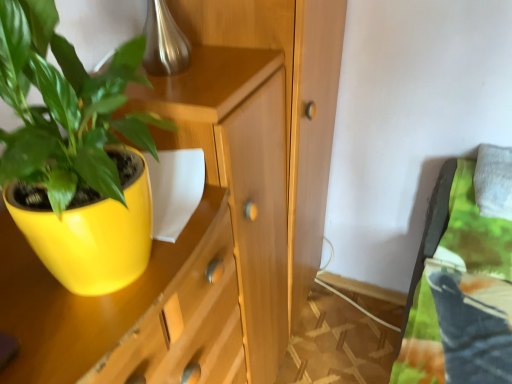
What do you see at coordinates (207, 213) in the screenshot?
I see `matte wood cabinet at center` at bounding box center [207, 213].

Image resolution: width=512 pixels, height=384 pixels. What are the coordinates of `matte wood cabinet at center` in the screenshot? It's located at (207, 213).

The height and width of the screenshot is (384, 512). What are the coordinates of `wooden dresser at center` in the screenshot? It's located at (288, 103).

Measure the distance between matte yellow pot at left and camera.

The depth of matte yellow pot at left is 15.63 inches.

The width and height of the screenshot is (512, 384). What are the coordinates of `matte wood cabinet at center` in the screenshot? It's located at (207, 213).

Identify the location of dresser on the right side of matte yellow pot at left. Image resolution: width=512 pixels, height=384 pixels. (288, 103).

From the picture: Is matte yellow pot at left next to wooden dresser at center and touching it?

→ No, matte yellow pot at left is not next to wooden dresser at center.

Is point (8, 156) in front of point (317, 56)?

Yes, point (8, 156) is closer to viewer.

Which is correct: matte yellow pot at left is inside wooden dresser at center, or outside of it?

matte yellow pot at left cannot be found inside wooden dresser at center.

Which of these two, white fabric pillow at upper right or wooden dresser at center, stands taller?

wooden dresser at center is taller.

From a real-world perspective, is white fabric pillow at upper right on wooden dresser at center?

Indeed, from a real-world perspective, white fabric pillow at upper right stands above wooden dresser at center.

From the image's perspective, is white fabric pillow at upper right on wooden dresser at center?

Yes, from the image's perspective, white fabric pillow at upper right is on top of wooden dresser at center.

Is point (488, 151) positioned after point (289, 92)?

Yes, point (488, 151) is behind point (289, 92).

Is point (259, 3) closer to camera compared to point (320, 187)?

That is True.

From a real-world perspective, who is located higher, wooden dresser at center or matte wood cabinet at center?

wooden dresser at center.

Where is `dresser above the matte wood cabinet at center (from a real-world perspective)`? This screenshot has height=384, width=512. dresser above the matte wood cabinet at center (from a real-world perspective) is located at coordinates (288, 103).

Based on the photo, considering the relative sizes of wooden dresser at center and matte wood cabinet at center in the image provided, is wooden dresser at center smaller than matte wood cabinet at center?

Correct, wooden dresser at center occupies less space than matte wood cabinet at center.

Is white fabric pillow at upper right facing towards matte wood cabinet at center?

No, white fabric pillow at upper right is not turned towards matte wood cabinet at center.

Can you confirm if white fabric pillow at upper right is positioned to the left of matte wood cabinet at center?

In fact, white fabric pillow at upper right is to the right of matte wood cabinet at center.

Consider the image. Can you tell me how much white fabric pillow at upper right and matte wood cabinet at center differ in facing direction?

90 degrees.

This screenshot has height=384, width=512. In the image, there is a matte yellow pot at left. Identify the location of cabinetry below it (from the image's perspective). (207, 213).

Is matte wood cabinet at center placed right next to matte yellow pot at left?

matte wood cabinet at center is not next to matte yellow pot at left, and they're not touching.

Is matte wood cabinet at center looking in the opposite direction of matte yellow pot at left?

No, matte wood cabinet at center is not facing the opposite direction of matte yellow pot at left.

Looking at this image, is matte wood cabinet at center taller than matte yellow pot at left?

Correct, matte wood cabinet at center is much taller as matte yellow pot at left.

Is matte yellow pot at left touching matte wood cabinet at center?

They are not placed beside each other.

Which of these two, matte yellow pot at left or matte wood cabinet at center, is bigger?

Bigger between the two is matte wood cabinet at center.

How many degrees apart are the facing directions of matte yellow pot at left and matte wood cabinet at center?

The facing directions of matte yellow pot at left and matte wood cabinet at center are 0.00033 degrees apart.

Is matte yellow pot at left oriented towards matte wood cabinet at center?

No, matte yellow pot at left is not oriented towards matte wood cabinet at center.

Do you think matte wood cabinet at center is within white fabric pillow at upper right, or outside of it?

matte wood cabinet at center cannot be found inside white fabric pillow at upper right.

Is point (226, 151) closer to viewer compared to point (509, 218)?

Yes, point (226, 151) is in front of point (509, 218).

Between matte wood cabinet at center and white fabric pillow at upper right, which one appears on the right side from the viewer's perspective?

From the viewer's perspective, white fabric pillow at upper right appears more on the right side.

Can you tell me how much matte wood cabinet at center and white fabric pillow at upper right differ in facing direction?

They differ by 90 degrees in their facing directions.

At what (x,y) coordinates should I click in order to perform the action: click on dresser located above the matte yellow pot at left (from the image's perspective). Please return your answer as a coordinate pair (x, y). This screenshot has width=512, height=384. Looking at the image, I should click on (288, 103).

This screenshot has width=512, height=384. In order to click on dresser lying on the left of white fabric pillow at upper right in this screenshot , I will do `click(288, 103)`.

Considering their positions, is wooden dresser at center positioned closer to matte yellow pot at left than matte wood cabinet at center?

Based on the image, matte wood cabinet at center appears to be nearer to matte yellow pot at left.

Considering their positions, is white fabric pillow at upper right positioned closer to matte wood cabinet at center than matte yellow pot at left?

matte yellow pot at left is closer to matte wood cabinet at center.

Looking at the image, which one is located further to matte wood cabinet at center, white fabric pillow at upper right or wooden dresser at center?

The object further to matte wood cabinet at center is white fabric pillow at upper right.

From the image, which object appears to be nearer to matte wood cabinet at center, wooden dresser at center or matte yellow pot at left?

Among the two, wooden dresser at center is located nearer to matte wood cabinet at center.

When comparing their distances from matte wood cabinet at center, does matte yellow pot at left or wooden dresser at center seem further?

matte yellow pot at left is further to matte wood cabinet at center.

Considering their positions, is matte wood cabinet at center positioned closer to white fabric pillow at upper right than matte yellow pot at left?

Result: matte wood cabinet at center lies closer to white fabric pillow at upper right than the other object.

Estimate the real-world distances between objects in this image. Which object is closer to wooden dresser at center, matte wood cabinet at center or matte yellow pot at left?

Among the two, matte wood cabinet at center is located nearer to wooden dresser at center.

From the image, which object appears to be nearer to white fabric pillow at upper right, matte yellow pot at left or matte wood cabinet at center?

matte wood cabinet at center lies closer to white fabric pillow at upper right than the other object.

The width and height of the screenshot is (512, 384). What are the coordinates of `dresser between matte wood cabinet at center and white fabric pillow at upper right in the horizontal direction` in the screenshot? It's located at (288, 103).

The image size is (512, 384). I want to click on cabinetry between matte yellow pot at left and white fabric pillow at upper right, so click(207, 213).

Identify the location of cabinetry between matte yellow pot at left and wooden dresser at center from front to back. (207, 213).

The width and height of the screenshot is (512, 384). What are the coordinates of `dresser between matte yellow pot at left and white fabric pillow at upper right` in the screenshot? It's located at (288, 103).